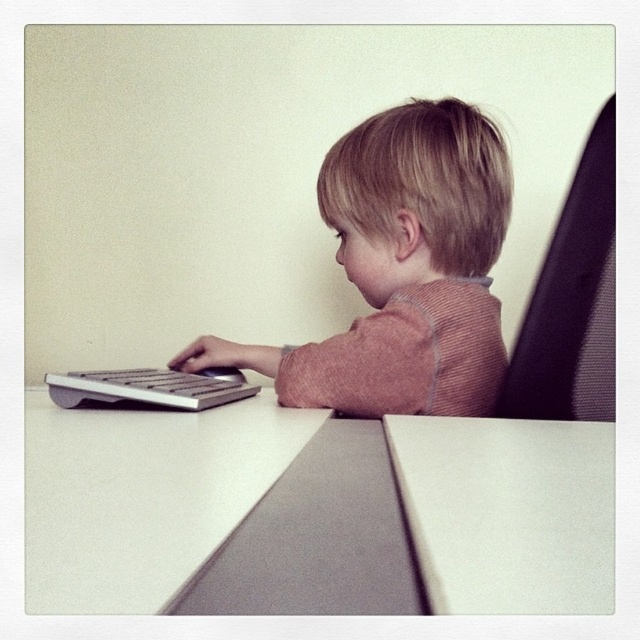
Who is more distant from viewer, (384,145) or (141,476)?

The point (384,145) is more distant.

Find the location of `light brown corduroy toddler at center`. light brown corduroy toddler at center is located at coordinates (403, 269).

Can you confirm if light brown corduroy toddler at center is taller than white matte table at lower center?

Correct, light brown corduroy toddler at center is much taller as white matte table at lower center.

Who is more forward, (396, 289) or (557, 589)?

Point (557, 589)

At what (x,y) coordinates should I click in order to perform the action: click on light brown corduroy toddler at center. Please return your answer as a coordinate pair (x, y). The height and width of the screenshot is (640, 640). Looking at the image, I should click on click(x=403, y=269).

This screenshot has width=640, height=640. I want to click on white matte table at lower center, so click(x=508, y=513).